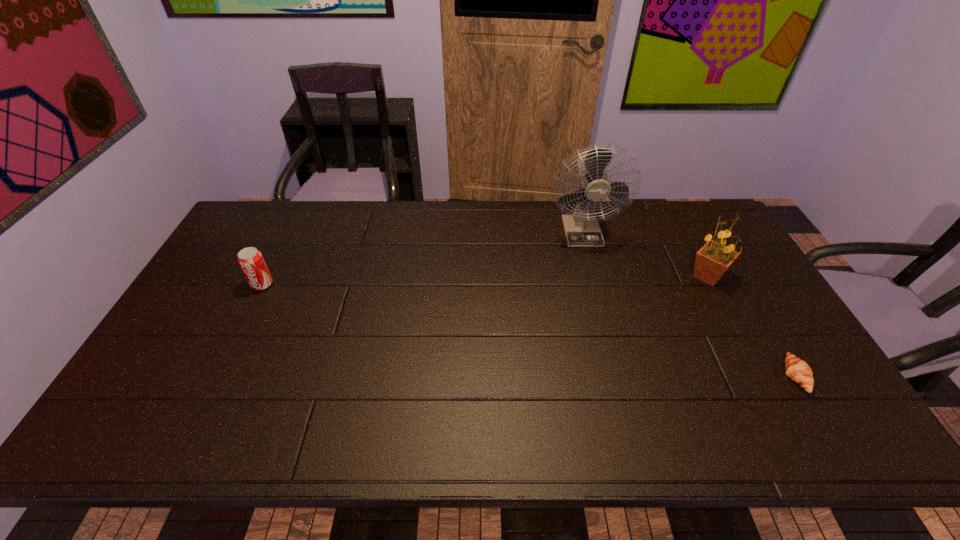
I want to click on blank area at the near edge, so click(x=697, y=420).

Find the location of a particular element. free point at the left edge is located at coordinates (168, 354).

Where is `blank space at the right edge`? blank space at the right edge is located at coordinates (731, 284).

Identify the location of vacant area at the far left corner. The width and height of the screenshot is (960, 540). (257, 231).

Identify the location of vacant area that lies between the third tallest object and the nearest object. The width and height of the screenshot is (960, 540). (529, 330).

I want to click on free area in between the shortest object and the soda can, so click(529, 330).

The height and width of the screenshot is (540, 960). What are the coordinates of `unoccupied position between the leftmost object and the third shortest object` in the screenshot? It's located at (485, 280).

Where is `free area in between the nearest object and the sunflower`? The image size is (960, 540). free area in between the nearest object and the sunflower is located at coordinates (751, 326).

What are the coordinates of `vacant region between the shortest object and the leftmost object` in the screenshot? It's located at (529, 330).

Identify the location of free space between the pastry and the fan. This screenshot has width=960, height=540. (688, 303).